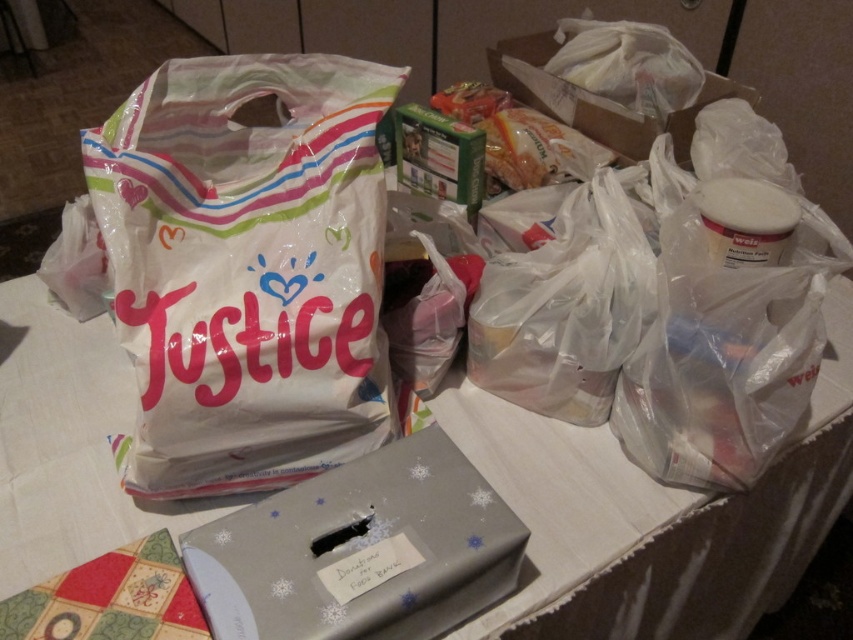
You are organizing a food drive and need to place the white plastic bag at left and the cardboard box with food items on the right. If the table is 36 inches wide, will both items fit side by side without overlapping?

The distance between the white plastic bag at left and the cardboard box with food items on the right is 27.36 inches. Since the table is 36 inches wide, there is enough space to place both items side by side without overlapping.

You are organizing items on a table for a food drive and need to stack the white paper bag at upper left and the silver paper box at lower center. Which item should you place at the bottom to ensure stability?

You should place the white paper bag at upper left at the bottom because it is taller than the silver paper box at lower center, providing a more stable base.

You are organizing items on a table for a food drive and need to place a new item between the white paper bag at upper left and the silver paper box at lower center. Based on their positions, which item should you place closer to the edge of the table to ensure the new item is between them?

Since the white paper bag at upper left is closer to you than the silver paper box at lower center, you should place the new item closer to the edge near the white paper bag at upper left to be between them.